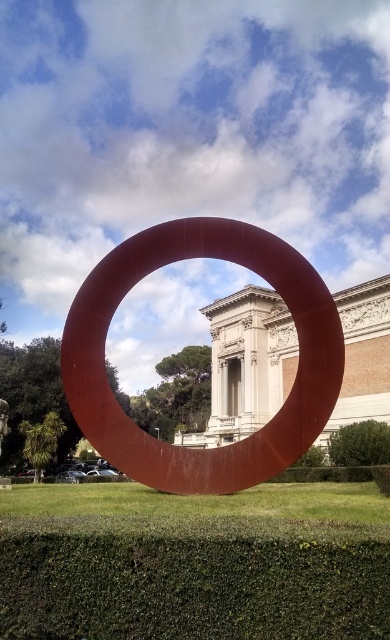
How much distance is there between matte red ring at center and green leafy hedge at lower right?

matte red ring at center is 22.13 meters from green leafy hedge at lower right.

Consider the image. Can you confirm if matte red ring at center is wider than green leafy hedge at lower right?

Indeed, matte red ring at center has a greater width compared to green leafy hedge at lower right.

I want to click on matte red ring at center, so click(219, 445).